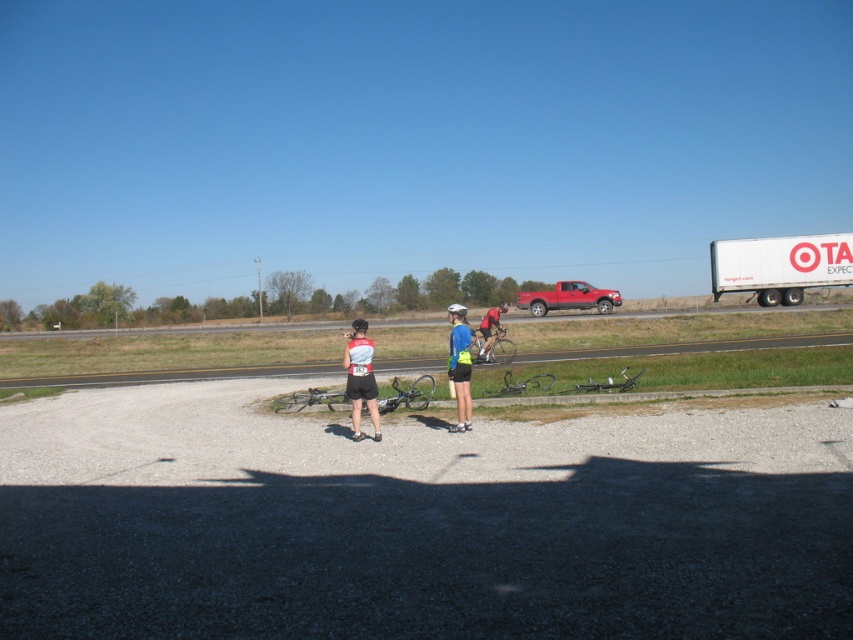
Question: Is reflective blue shorts at center to the right of metallic red pickup truck at center from the viewer's perspective?

Choices:
 (A) yes
 (B) no

Answer: (B)

Question: Does white and red athletic jersey at center have a smaller size compared to white matte bicycle helmet at center?

Choices:
 (A) no
 (B) yes

Answer: (B)

Question: Which object is farther from the camera taking this photo?

Choices:
 (A) metallic red pickup truck at center
 (B) white cardboard truck at right
 (C) reflective blue shorts at center

Answer: (B)

Question: Which is nearer to the metallic red pickup truck at center?

Choices:
 (A) white cardboard truck at right
 (B) asphalt road at center

Answer: (A)

Question: Considering the real-world distances, which object is farthest from the white matte bicycle helmet at center?

Choices:
 (A) reflective blue shorts at center
 (B) white and red athletic jersey at center
 (C) metallic red pickup truck at center
 (D) asphalt road at center

Answer: (C)

Question: Can you confirm if asphalt road at center is positioned to the right of blue fabric shirt at center?

Choices:
 (A) no
 (B) yes

Answer: (B)